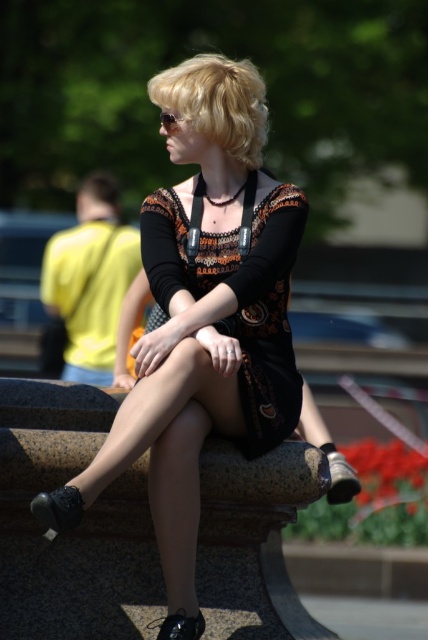
Looking at this image, you are a photographer trying to capture a candid shot of the person in the matte black dress at center and the blonde hair at center. Given that your camera has a maximum focus range of 2.5 meters, will you be able to focus on both subjects simultaneously?

The matte black dress at center and the blonde hair at center are 2.78 meters apart, which exceeds the camera maximum focus range of 2.5 meters. Therefore, you cannot focus on both subjects simultaneously.

Based on the scene description, if someone is looking at the person from the front, which object would they see first between the matte black dress at center and the blonde hair at center?

The blonde hair at center would be seen first because it is positioned above the matte black dress at center, which is located below it.